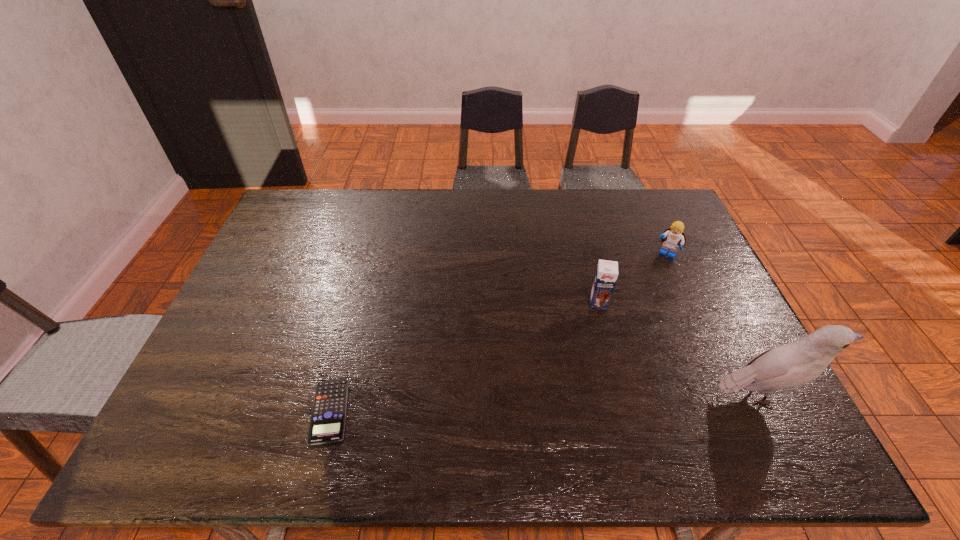
Find the location of a particular element. This screenshot has height=540, width=960. vacant space at the near edge of the desktop is located at coordinates (455, 407).

Find the location of a particular element. vacant region at the left edge is located at coordinates (304, 235).

You are a GUI agent. You are given a task and a screenshot of the screen. Output one action in this format:
    pyautogui.click(x=<x>, y=<y>)
    Task: Click on the vacant point at the far left corner
    
    Given the screenshot: What is the action you would take?
    pyautogui.click(x=334, y=190)

Identify the location of free region at the near left corner of the desktop. This screenshot has width=960, height=540. (244, 382).

Identify the location of free space at the near right corner. This screenshot has width=960, height=540. (713, 395).

I want to click on vacant space in between the Lego and the tallest object, so click(713, 324).

Image resolution: width=960 pixels, height=540 pixels. I want to click on vacant point located between the tallest object and the shortest object, so click(x=545, y=403).

At what (x,y) coordinates should I click in order to perform the action: click on vacant area that lies between the second farthest object and the shortest object. Please return your answer as a coordinate pair (x, y). The image size is (960, 540). Looking at the image, I should click on (465, 357).

This screenshot has height=540, width=960. In order to click on free spot between the second shortest object and the leftmost object in this screenshot , I will do pyautogui.click(x=498, y=333).

Identify the location of vacant space in between the second object from left to right and the calculator. Image resolution: width=960 pixels, height=540 pixels. (465, 357).